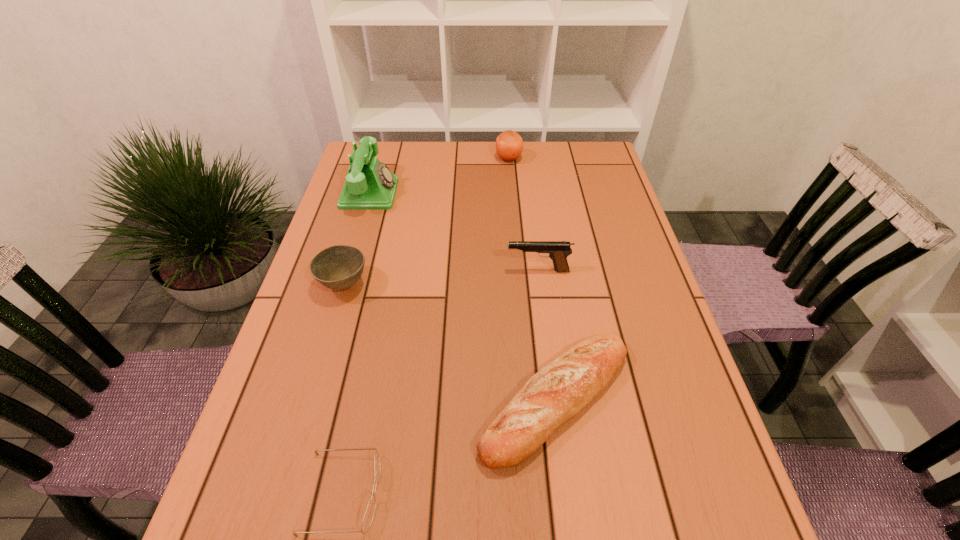
This screenshot has height=540, width=960. Find the location of `vacant space that satisfies the following two spatial constraints: 1. at the muzzle of the pistol; 2. on the front side of the bowl`. vacant space that satisfies the following two spatial constraints: 1. at the muzzle of the pistol; 2. on the front side of the bowl is located at coordinates (540, 286).

Where is `vacant space that satisfies the following two spatial constraints: 1. at the muzzle of the pistol; 2. on the back side of the baguet`? This screenshot has width=960, height=540. vacant space that satisfies the following two spatial constraints: 1. at the muzzle of the pistol; 2. on the back side of the baguet is located at coordinates (554, 400).